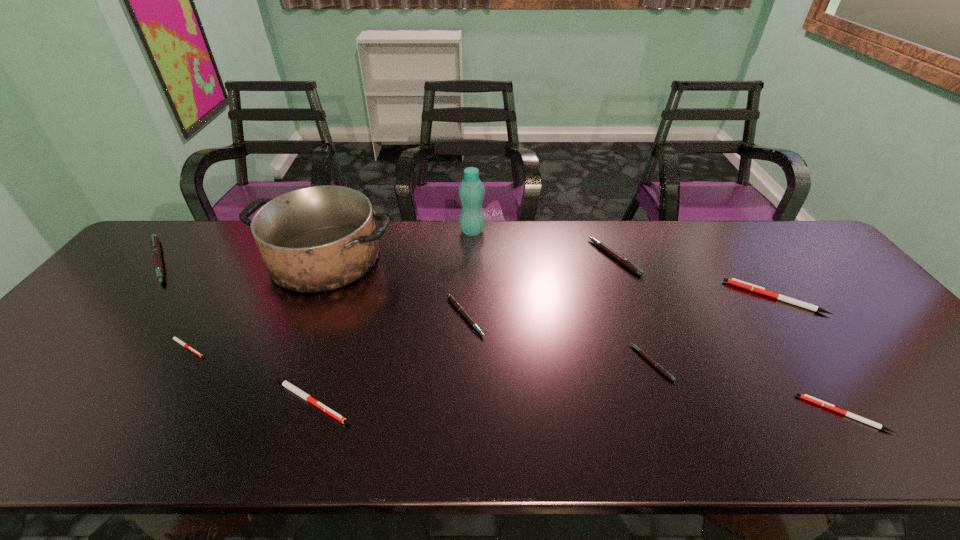
Find the location of a particular element. The width and height of the screenshot is (960, 540). vacant space located 0.100m on the clicker of the farthest white pen is located at coordinates (696, 298).

At what (x,y) coordinates should I click in order to perform the action: click on free region located on the clicker of the farthest white pen. Please return your answer as a coordinate pair (x, y). Looking at the image, I should click on tap(675, 298).

Where is `vacant region located 0.380m on the clicker of the farthest white pen`? The image size is (960, 540). vacant region located 0.380m on the clicker of the farthest white pen is located at coordinates (594, 298).

At what (x,y) coordinates should I click in order to perform the action: click on vacant space situated 0.160m at the nib of the third farthest pink pen. Please return your answer as a coordinate pair (x, y). Looking at the image, I should click on (545, 316).

At what (x,y) coordinates should I click in order to perform the action: click on vacant region located on the clicker of the third smallest white pen. Please return your answer as a coordinate pair (x, y). Looking at the image, I should click on (445, 401).

Where is `free region located at the nib of the smallest pink pen`? free region located at the nib of the smallest pink pen is located at coordinates (467, 362).

You are a GUI agent. You are given a task and a screenshot of the screen. Output one action in this format:
    pyautogui.click(x=<x>, y=<y>)
    Task: Click on the free region located 0.050m at the nib of the smallest pink pen
    
    Given the screenshot: What is the action you would take?
    pyautogui.click(x=614, y=362)

I want to click on vacant point located 0.260m at the nib of the smallest pink pen, so click(x=526, y=362).

Where is `blank area located 0.330m on the clicker of the second smallest white pen`? blank area located 0.330m on the clicker of the second smallest white pen is located at coordinates (653, 414).

You are a GUI agent. You are given a task and a screenshot of the screen. Output one action in this format:
    pyautogui.click(x=<x>, y=<y>)
    Task: Click on the vacant space situated 0.170m on the clicker of the second smallest white pen
    Image resolution: width=960 pixels, height=540 pixels.
    Given the screenshot: What is the action you would take?
    pyautogui.click(x=728, y=414)